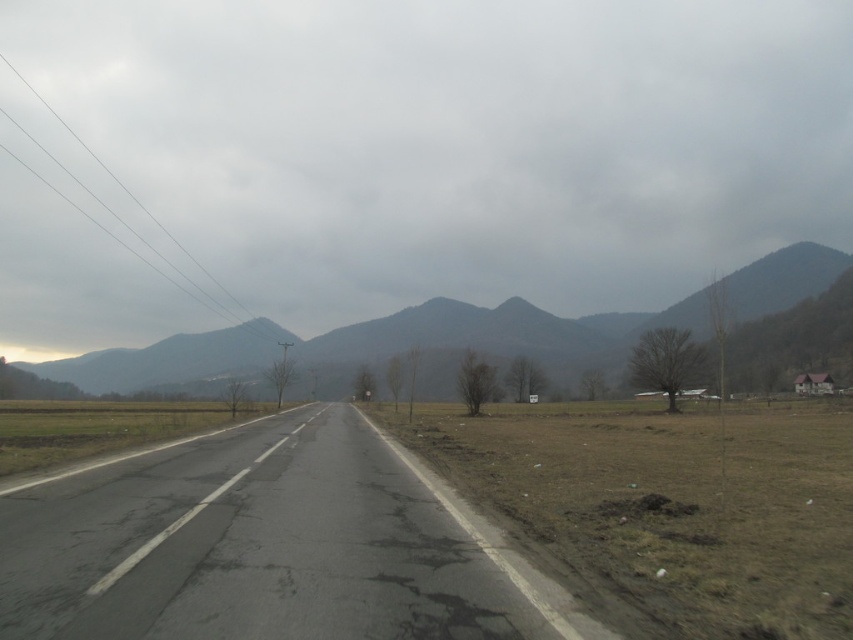
You are driving a car and see the gray cloudy sky at upper center and the gray rocky mountain at center. Which object is located to the right side of the other?

The gray cloudy sky at upper center is to the right of gray rocky mountain at center.

You are a truck driver planning to take a photo of the gray rocky mountain at center from the asphalt road at center. Considering the size difference, which object would appear closer to the camera in the photo?

The asphalt road at center appears closer to the camera in the photo because it has a smaller size compared to the gray rocky mountain at center, indicating it is nearer.